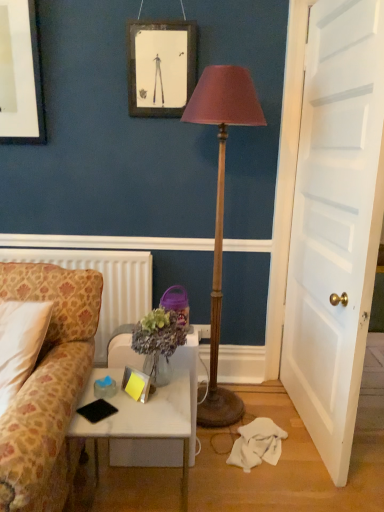
Locate an element on the screen. This screenshot has width=384, height=512. free space to the right of blue translucent cup at lower left is located at coordinates (157, 402).